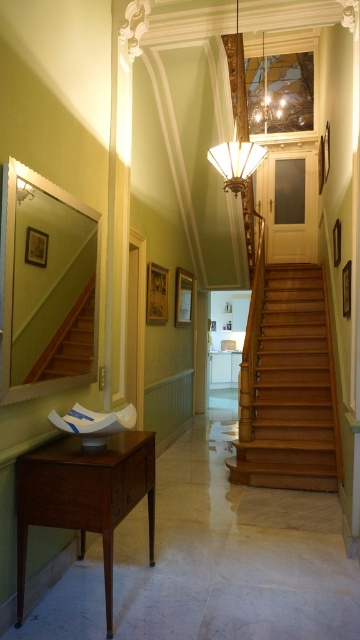
You are standing in the hallway and want to reach the wooden stairs at left. The matte glass lampshade at center is in your path. Can you walk around it to get to the stairs?

The wooden stairs at left is in front of the matte glass lampshade at center, so the lampshade is behind the stairs. You can walk around the sides of the wooden stairs at left to reach them without obstruction from the matte glass lampshade at center.